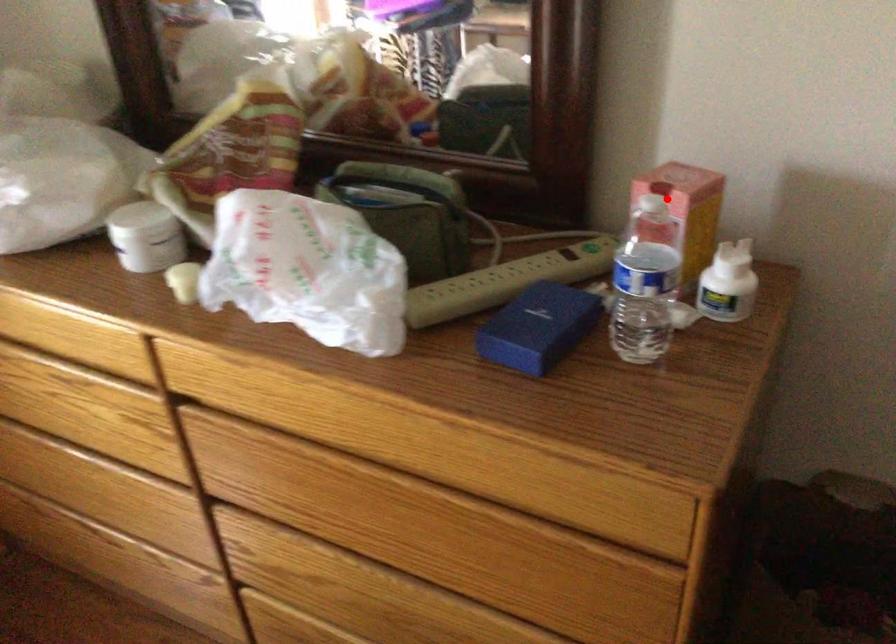
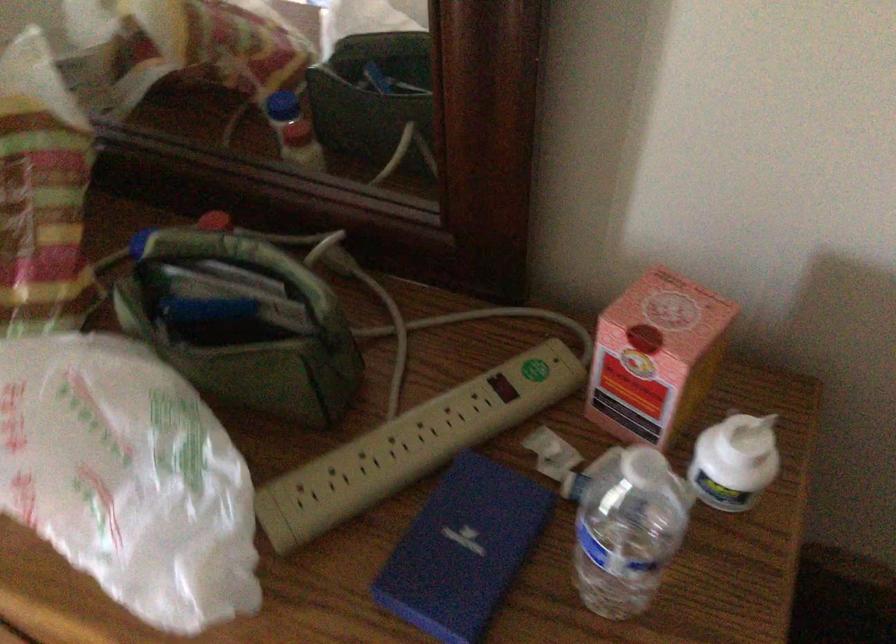
Locate, in the second image, the point that corresponds to the highlighted location in the first image.

(656, 357)